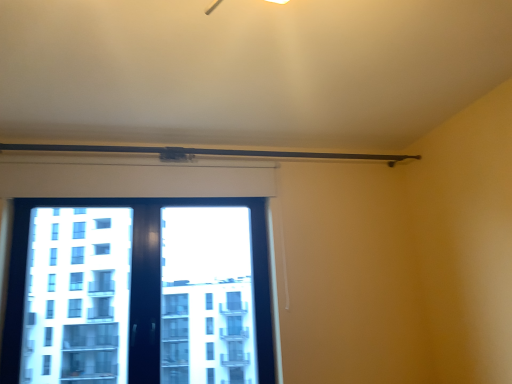
This screenshot has height=384, width=512. Find the location of `transparent glass window at lower left`. transparent glass window at lower left is located at coordinates (138, 292).

Describe the element at coordinates (138, 292) in the screenshot. I see `transparent glass window at lower left` at that location.

You are a GUI agent. You are given a task and a screenshot of the screen. Output one action in this format:
    pyautogui.click(x=<x>, y=<y>)
    Task: Click on the transparent glass window at lower left
    
    Given the screenshot: What is the action you would take?
    pyautogui.click(x=138, y=292)